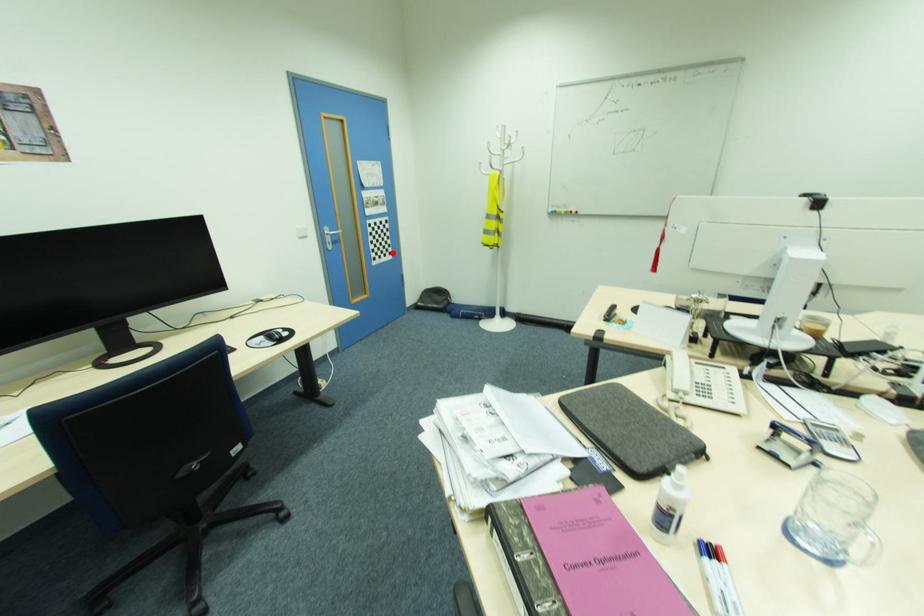
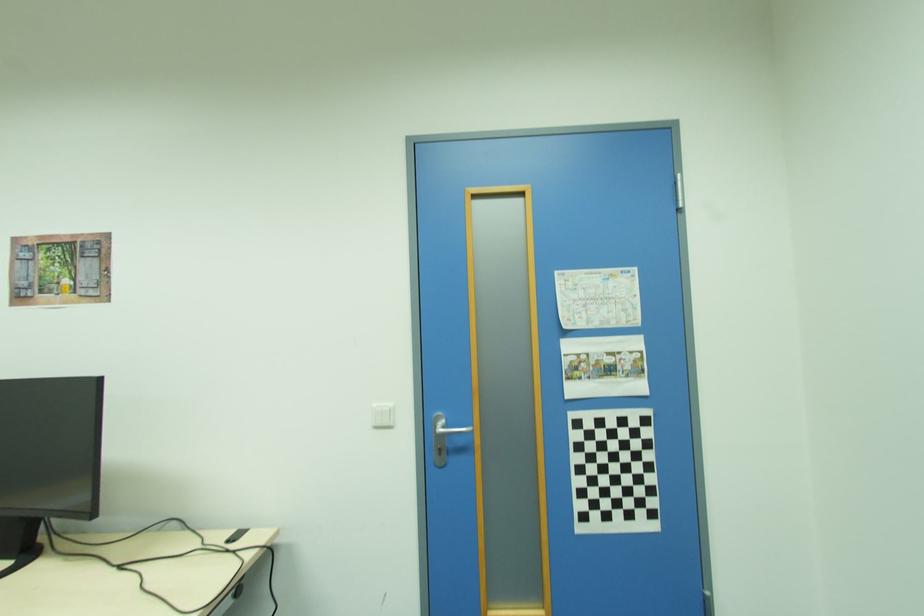
Question: I am providing you with two images of the same scene from different viewpoints. Given a red point in image1, look at the same physical point in image2. Is it:

Choices:
 (A) Closer to the viewpoint
 (B) Farther from the viewpoint

Answer: (B)